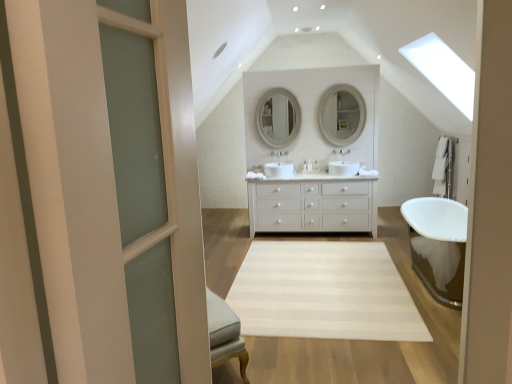
Question: In terms of size, does white matte cabinet at center appear bigger or smaller than matte white mirror at upper center, the 2th mirror positioned from the left?

Choices:
 (A) small
 (B) big

Answer: (B)

Question: Do you think white matte cabinet at center is within matte white mirror at upper center, arranged as the first mirror when viewed from the right, or outside of it?

Choices:
 (A) inside
 (B) outside

Answer: (B)

Question: Estimate the real-world distances between objects in this image. Which object is closer to the white matte cabinet at center?

Choices:
 (A) clear glass door at left
 (B) white glossy sink at center
 (C) white ceramic faucet at center
 (D) matte white mirror at center, which is the first mirror from left to right
 (E) white striped rug at center

Answer: (B)

Question: Which object is the farthest from the white ceramic faucet at center?

Choices:
 (A) matte white mirror at center, positioned as the 2th mirror in right-to-left order
 (B) white glossy sink at center
 (C) white striped rug at center
 (D) clear glass door at left
 (E) white matte cabinet at center

Answer: (D)